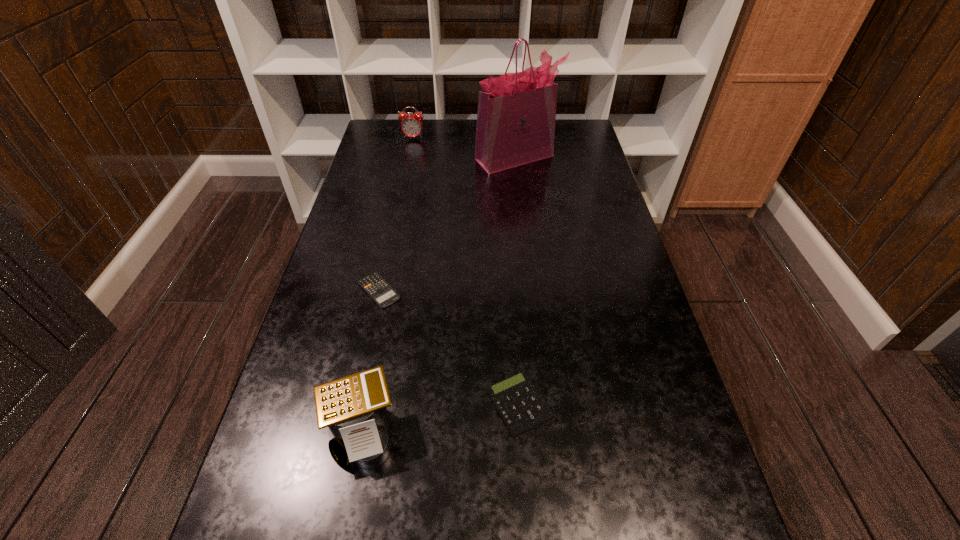
Where is `free space at the left edge`? free space at the left edge is located at coordinates (373, 309).

In the image, there is a desktop. At what (x,y) coordinates should I click in order to perform the action: click on blank space at the right edge. Please return your answer as a coordinate pair (x, y). Looking at the image, I should click on (570, 238).

You are a GUI agent. You are given a task and a screenshot of the screen. Output one action in this format:
    pyautogui.click(x=<x>, y=<y>)
    Task: Click on the vacant region at the far right corner of the desktop
    The image size is (960, 540).
    Given the screenshot: What is the action you would take?
    pyautogui.click(x=567, y=122)

What are the coordinates of `free spot between the farthest calculator and the farthest object` in the screenshot? It's located at (396, 214).

The width and height of the screenshot is (960, 540). Find the location of `vacant space that is in between the second farthest object and the rightmost calculator`. vacant space that is in between the second farthest object and the rightmost calculator is located at coordinates (517, 281).

Identify the location of free area in between the fourth nearest object and the tallest calculator. The width and height of the screenshot is (960, 540). (439, 294).

Locate an element on the screen. Image resolution: width=960 pixels, height=540 pixels. free area in between the farthest calculator and the tallest calculator is located at coordinates (371, 361).

The image size is (960, 540). What are the coordinates of `free space between the shortest object and the shopping bag` in the screenshot? It's located at (447, 224).

Where is `free space between the fourth nearest object and the tallest calculator`? free space between the fourth nearest object and the tallest calculator is located at coordinates (439, 294).

Locate an element on the screen. free space between the fourth nearest object and the shortest object is located at coordinates (447, 224).